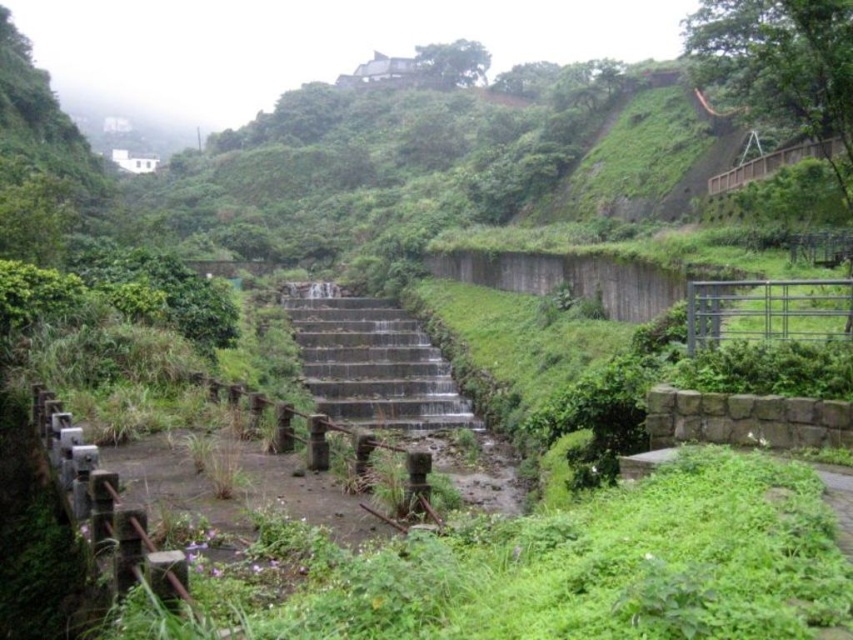
Identify the location of gray concrete stairs at center. (374, 365).

Which of these two, gray concrete stairs at center or metallic silver rail at right, stands taller?

Standing taller between the two is gray concrete stairs at center.

The image size is (853, 640). Find the location of `gray concrete stairs at center`. gray concrete stairs at center is located at coordinates (374, 365).

Locate an element on the screen. Image resolution: width=853 pixels, height=640 pixels. gray concrete stairs at center is located at coordinates (374, 365).

Can you confirm if gray concrete stairs at center is smaller than rusty metal rail at center?

Incorrect, gray concrete stairs at center is not smaller in size than rusty metal rail at center.

Find the location of a particular element. Image resolution: width=853 pixels, height=640 pixels. gray concrete stairs at center is located at coordinates (374, 365).

Which is behind, point (732, 280) or point (287, 442)?

The point (732, 280) is behind.

Does point (747, 280) come farther from viewer compared to point (404, 502)?

That is True.

Between point (744, 314) and point (405, 508), which one is positioned behind?

Point (744, 314)

The width and height of the screenshot is (853, 640). In order to click on metallic silver rail at right in this screenshot , I will do `click(767, 310)`.